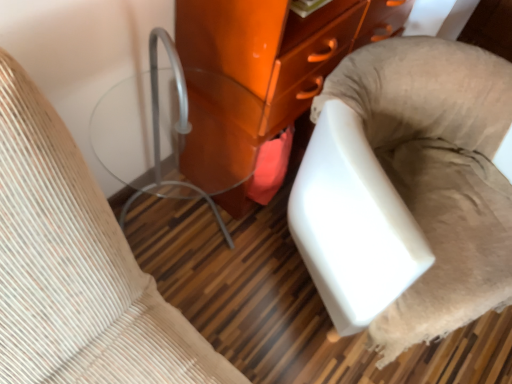
Describe the element at coordinates (408, 190) in the screenshot. The height and width of the screenshot is (384, 512). I see `white fabric chair at lower right, acting as the first furniture starting from the right` at that location.

Find the location of `glossy orange cabinet at center, the 2th furniture viewed from the left`. glossy orange cabinet at center, the 2th furniture viewed from the left is located at coordinates (262, 71).

From the image's perspective, is matte glass side table at left, which is counted as the 3th furniture, starting from the right, below white fabric chair at lower right, positioned as the 3th furniture in left-to-right order?

No.

Is matte glass side table at left, the first furniture viewed from the left, not close to white fabric chair at lower right, acting as the first furniture starting from the right?

That's not correct — matte glass side table at left, the first furniture viewed from the left, is a little close to white fabric chair at lower right, acting as the first furniture starting from the right.

What's the angular difference between matte glass side table at left, which is counted as the 3th furniture, starting from the right, and white fabric chair at lower right, acting as the first furniture starting from the right,'s facing directions?

25.9 degrees separate the facing orientations of matte glass side table at left, which is counted as the 3th furniture, starting from the right, and white fabric chair at lower right, acting as the first furniture starting from the right.

In the image, is matte glass side table at left, which is counted as the 3th furniture, starting from the right, positioned in front of or behind white fabric chair at lower right, positioned as the 3th furniture in left-to-right order?

Visually, matte glass side table at left, which is counted as the 3th furniture, starting from the right, is located in front of white fabric chair at lower right, positioned as the 3th furniture in left-to-right order.

Does point (399, 286) appear closer or farther from the camera than point (206, 176)?

Point (399, 286) is closer to the camera than point (206, 176).

Is white fabric chair at lower right, acting as the first furniture starting from the right, next to glossy orange cabinet at center, which is the second furniture in right-to-left order, and touching it?

There is a gap between white fabric chair at lower right, acting as the first furniture starting from the right, and glossy orange cabinet at center, which is the second furniture in right-to-left order.

Measure the distance between white fabric chair at lower right, positioned as the 3th furniture in left-to-right order, and glossy orange cabinet at center, the 2th furniture viewed from the left.

white fabric chair at lower right, positioned as the 3th furniture in left-to-right order, is 12.64 inches away from glossy orange cabinet at center, the 2th furniture viewed from the left.

Between white fabric chair at lower right, acting as the first furniture starting from the right, and glossy orange cabinet at center, the 2th furniture viewed from the left, which one has larger width?

With larger width is white fabric chair at lower right, acting as the first furniture starting from the right.

Is matte glass side table at left, which is counted as the 3th furniture, starting from the right, far from glossy orange cabinet at center, the 2th furniture viewed from the left?

No, matte glass side table at left, which is counted as the 3th furniture, starting from the right, is not far away from glossy orange cabinet at center, the 2th furniture viewed from the left.

Does matte glass side table at left, which is counted as the 3th furniture, starting from the right, have a greater width compared to glossy orange cabinet at center, the 2th furniture viewed from the left?

Indeed, matte glass side table at left, which is counted as the 3th furniture, starting from the right, has a greater width compared to glossy orange cabinet at center, the 2th furniture viewed from the left.

Can we say matte glass side table at left, the first furniture viewed from the left, lies outside glossy orange cabinet at center, the 2th furniture viewed from the left?

matte glass side table at left, the first furniture viewed from the left, lies outside glossy orange cabinet at center, the 2th furniture viewed from the left,'s area.

Considering the sizes of objects glossy orange cabinet at center, which is the second furniture in right-to-left order, and white fabric chair at lower right, positioned as the 3th furniture in left-to-right order, in the image provided, who is wider, glossy orange cabinet at center, which is the second furniture in right-to-left order, or white fabric chair at lower right, positioned as the 3th furniture in left-to-right order,?

white fabric chair at lower right, positioned as the 3th furniture in left-to-right order.

Is glossy orange cabinet at center, the 2th furniture viewed from the left, bigger than white fabric chair at lower right, positioned as the 3th furniture in left-to-right order?

Correct, glossy orange cabinet at center, the 2th furniture viewed from the left, is larger in size than white fabric chair at lower right, positioned as the 3th furniture in left-to-right order.

Is glossy orange cabinet at center, the 2th furniture viewed from the left, to the left of white fabric chair at lower right, positioned as the 3th furniture in left-to-right order, from the viewer's perspective?

Yes.

Can you see glossy orange cabinet at center, which is the second furniture in right-to-left order, touching white fabric chair at lower right, positioned as the 3th furniture in left-to-right order?

No, glossy orange cabinet at center, which is the second furniture in right-to-left order, is not beside white fabric chair at lower right, positioned as the 3th furniture in left-to-right order.

You are a GUI agent. You are given a task and a screenshot of the screen. Output one action in this format:
    pyautogui.click(x=<x>, y=<y>)
    Task: Click on the furniture above the matte glass side table at left, the first furniture viewed from the left (from the image's perspective)
    Image resolution: width=512 pixels, height=384 pixels.
    Given the screenshot: What is the action you would take?
    pyautogui.click(x=262, y=71)

From a real-world perspective, is glossy orange cabinet at center, which is the second furniture in right-to-left order, beneath matte glass side table at left, the first furniture viewed from the left?

No, from a real-world perspective, glossy orange cabinet at center, which is the second furniture in right-to-left order, is not below matte glass side table at left, the first furniture viewed from the left.

Between glossy orange cabinet at center, which is the second furniture in right-to-left order, and matte glass side table at left, which is counted as the 3th furniture, starting from the right, which one has smaller size?

Smaller between the two is matte glass side table at left, which is counted as the 3th furniture, starting from the right.

From the image's perspective, is glossy orange cabinet at center, which is the second furniture in right-to-left order, under matte glass side table at left, which is counted as the 3th furniture, starting from the right?

No, from the image's perspective, glossy orange cabinet at center, which is the second furniture in right-to-left order, is not below matte glass side table at left, which is counted as the 3th furniture, starting from the right.

How distant is white fabric chair at lower right, positioned as the 3th furniture in left-to-right order, from matte glass side table at left, the first furniture viewed from the left?

white fabric chair at lower right, positioned as the 3th furniture in left-to-right order, is 23.53 inches from matte glass side table at left, the first furniture viewed from the left.

Considering the sizes of white fabric chair at lower right, acting as the first furniture starting from the right, and matte glass side table at left, which is counted as the 3th furniture, starting from the right, in the image, is white fabric chair at lower right, acting as the first furniture starting from the right, wider or thinner than matte glass side table at left, which is counted as the 3th furniture, starting from the right,?

Clearly, white fabric chair at lower right, acting as the first furniture starting from the right, has more width compared to matte glass side table at left, which is counted as the 3th furniture, starting from the right.

Identify the location of furniture in front of the white fabric chair at lower right, acting as the first furniture starting from the right. The height and width of the screenshot is (384, 512). (76, 268).

Is white fabric chair at lower right, positioned as the 3th furniture in left-to-right order, positioned far away from matte glass side table at left, the first furniture viewed from the left?

white fabric chair at lower right, positioned as the 3th furniture in left-to-right order, is actually quite close to matte glass side table at left, the first furniture viewed from the left.

Locate an element on the screen. The height and width of the screenshot is (384, 512). the 1st furniture behind the matte glass side table at left, the first furniture viewed from the left, counting from the anchor's position is located at coordinates (408, 190).

From a real-world perspective, starting from the white fabric chair at lower right, positioned as the 3th furniture in left-to-right order, which furniture is the 2nd one vertically above it? Please provide its 2D coordinates.

[(262, 71)]

Which object lies further to the anchor point matte glass side table at left, which is counted as the 3th furniture, starting from the right, white fabric chair at lower right, acting as the first furniture starting from the right, or glossy orange cabinet at center, which is the second furniture in right-to-left order?

glossy orange cabinet at center, which is the second furniture in right-to-left order, is positioned further to the anchor matte glass side table at left, which is counted as the 3th furniture, starting from the right.

When comparing their distances from glossy orange cabinet at center, the 2th furniture viewed from the left, does white fabric chair at lower right, acting as the first furniture starting from the right, or matte glass side table at left, which is counted as the 3th furniture, starting from the right, seem further?

The object further to glossy orange cabinet at center, the 2th furniture viewed from the left, is matte glass side table at left, which is counted as the 3th furniture, starting from the right.

Looking at the image, which one is located closer to glossy orange cabinet at center, the 2th furniture viewed from the left, matte glass side table at left, the first furniture viewed from the left, or white fabric chair at lower right, positioned as the 3th furniture in left-to-right order?

white fabric chair at lower right, positioned as the 3th furniture in left-to-right order.

Which object lies nearer to the anchor point matte glass side table at left, which is counted as the 3th furniture, starting from the right, glossy orange cabinet at center, which is the second furniture in right-to-left order, or white fabric chair at lower right, acting as the first furniture starting from the right?

white fabric chair at lower right, acting as the first furniture starting from the right, lies closer to matte glass side table at left, which is counted as the 3th furniture, starting from the right, than the other object.

Looking at the image, which one is located further to white fabric chair at lower right, acting as the first furniture starting from the right, glossy orange cabinet at center, the 2th furniture viewed from the left, or matte glass side table at left, the first furniture viewed from the left?

matte glass side table at left, the first furniture viewed from the left, is further to white fabric chair at lower right, acting as the first furniture starting from the right.

Based on their spatial positions, is matte glass side table at left, the first furniture viewed from the left, or glossy orange cabinet at center, the 2th furniture viewed from the left, further from white fabric chair at lower right, positioned as the 3th furniture in left-to-right order?

The object further to white fabric chair at lower right, positioned as the 3th furniture in left-to-right order, is matte glass side table at left, the first furniture viewed from the left.

You are a GUI agent. You are given a task and a screenshot of the screen. Output one action in this format:
    pyautogui.click(x=<x>, y=<y>)
    Task: Click on the furniture between matte glass side table at left, which is counted as the 3th furniture, starting from the right, and white fabric chair at lower right, positioned as the 3th furniture in left-to-right order
    
    Given the screenshot: What is the action you would take?
    pyautogui.click(x=262, y=71)